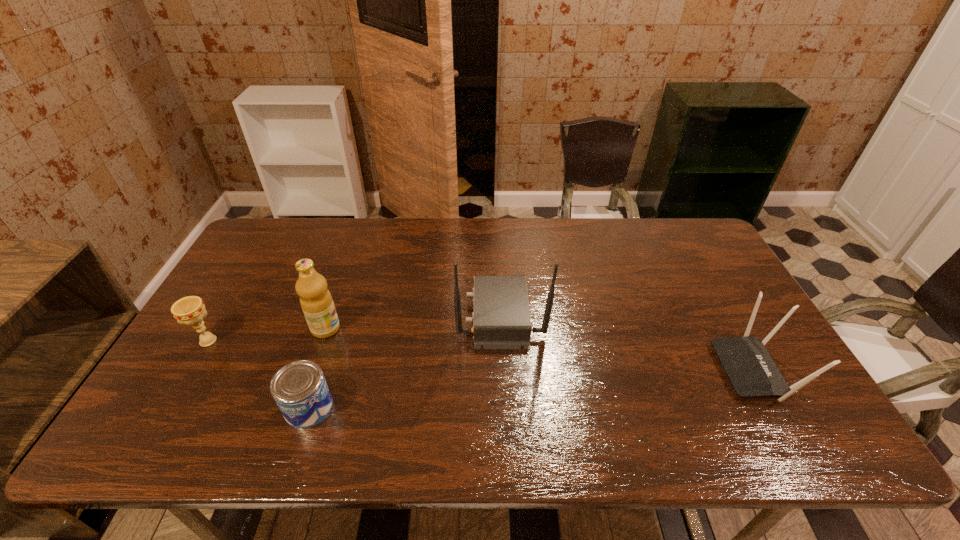
This screenshot has height=540, width=960. What are the coordinates of `the left router` in the screenshot? It's located at (501, 320).

What are the coordinates of `the fourth object from left to right` in the screenshot? It's located at (501, 320).

I want to click on olive oil, so [316, 301].

Locate an element on the screen. Image resolution: width=960 pixels, height=540 pixels. the shorter router is located at coordinates (750, 369).

The width and height of the screenshot is (960, 540). I want to click on the right router, so click(750, 369).

This screenshot has width=960, height=540. I want to click on chalice, so click(190, 310).

Locate an element on the screen. the shortest object is located at coordinates (299, 388).

Locate an element on the screen. free spot located on the back of the left router to connect cables is located at coordinates (326, 315).

Locate an element on the screen. This screenshot has height=540, width=960. vacant area located on the back of the left router to connect cables is located at coordinates pos(368,315).

What are the coordinates of `vacant area situated 0.220m on the back of the left router to connect cables` in the screenshot? It's located at (381, 315).